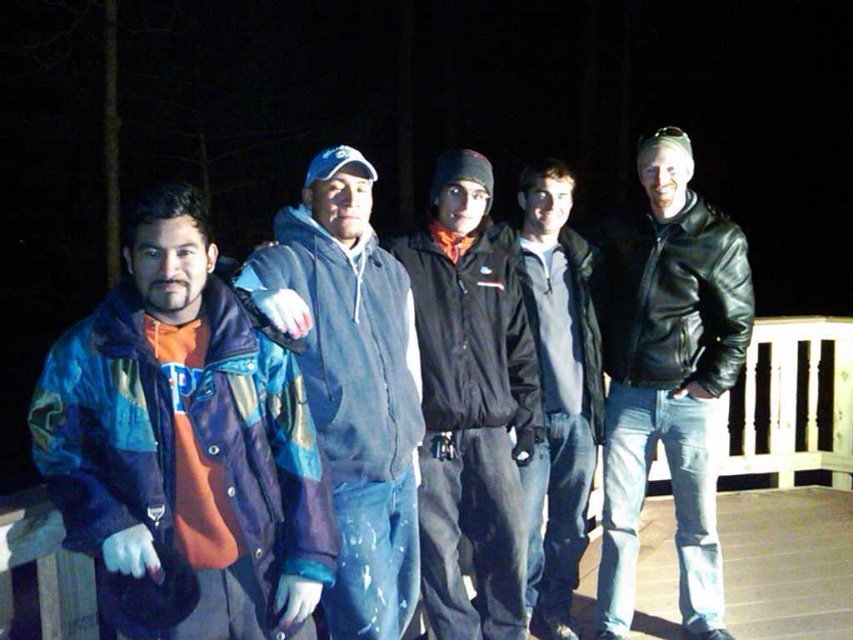
You are trying to decide which item to take with you for warmth. The black matte jacket at center and the wooden at center are both in your view. Which one is wider?

The black matte jacket at center is wider than the wooden at center.

You are standing on the wooden deck where the five people are gathered. You need to determine which of the two points, point (51, 499) or point (439, 243), is nearer to your current position. Which one is closer?

Point (51, 499) is closer to the camera than point (439, 243), so it is the closer one.

You are standing at the center of the wooden deck and want to hand a gift to the person wearing the black leather jacket at right. Which direction should you move to reach them?

The black leather jacket at right is located at point 0.595 on the x axis and 0.785 on the y axis. Since you are at the center, you should move towards the right and slightly forward to reach the person wearing the black leather jacket at right.